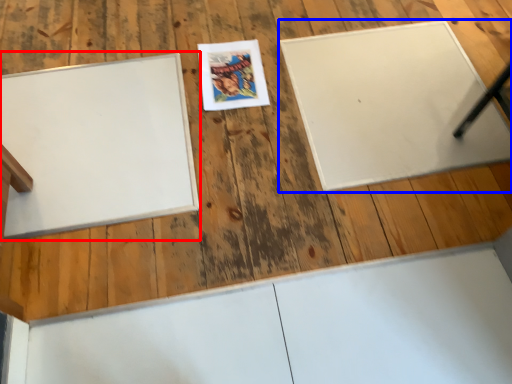
Question: Which object appears closest to the camera in this image, bulletin board (highlighted by a red box) or bulletin board (highlighted by a blue box)?

Choices:
 (A) bulletin board
 (B) bulletin board

Answer: (A)